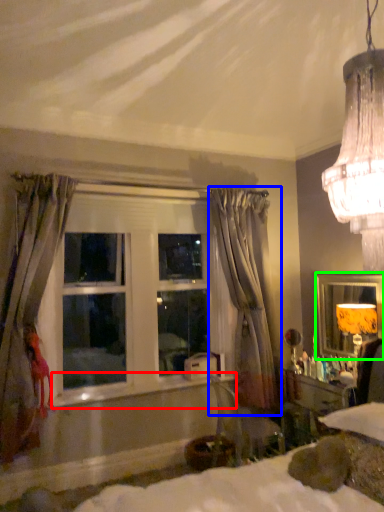
Question: Estimate the real-world distances between objects in this image. Which object is farther from window sill (highlighted by a red box), curtain (highlighted by a blue box) or mirror (highlighted by a green box)?

Choices:
 (A) curtain
 (B) mirror

Answer: (B)